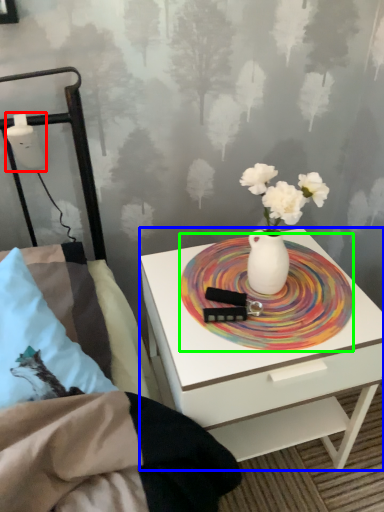
Question: Considering the real-world distances, which object is farthest from table lamp (highlighted by a red box)? nightstand (highlighted by a blue box) or platter (highlighted by a green box)?

Choices:
 (A) nightstand
 (B) platter

Answer: (A)